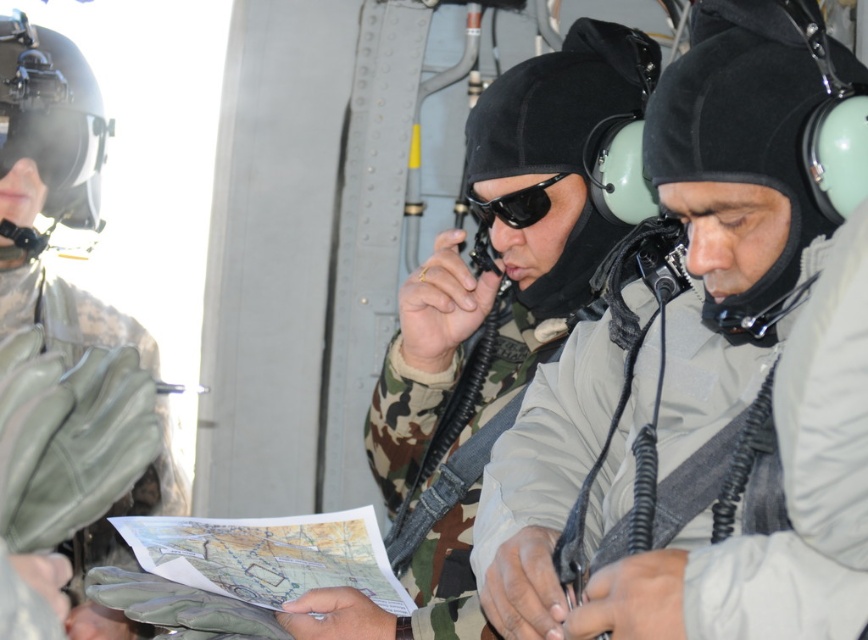
You are navigating a military aircraft and need to locate the camo fabric uniform at center. According to the coordinates provided, where exactly is the camo fabric uniform positioned in the image?

The camo fabric uniform at center is located at coordinates point (485, 321).

You are a military equipment inspector tasked with ensuring all gear fits properly. You notice the camo fabric uniform at center and the black matte sunglasses at center. Which item would require more space in a storage compartment?

The camo fabric uniform at center is larger in size than the black matte sunglasses at center, so it would require more space in a storage compartment.